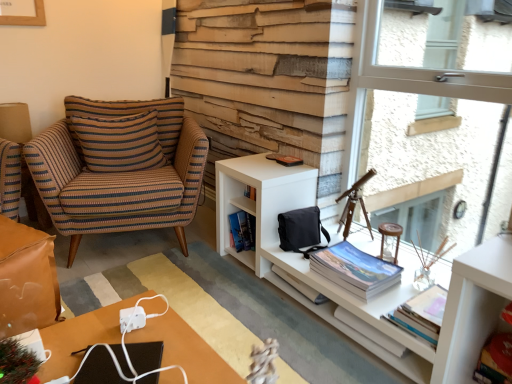
Where is `free space in front of brown striped fabric armchair at left`? This screenshot has height=384, width=512. free space in front of brown striped fabric armchair at left is located at coordinates (150, 288).